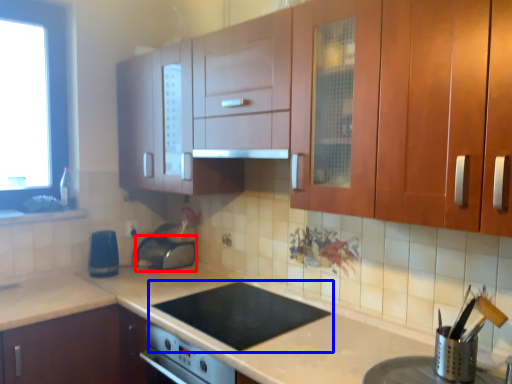
Question: Among these objects, which one is nearest to the camera, appliance (highlighted by a red box) or gas stove (highlighted by a blue box)?

Choices:
 (A) appliance
 (B) gas stove

Answer: (B)